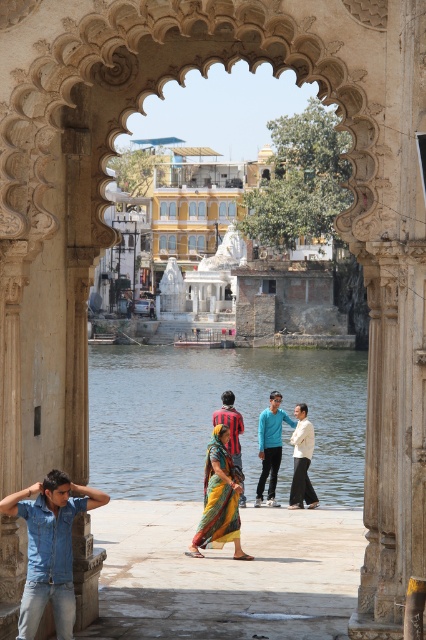
Question: Is denim shirt at lower left thinner than yellow silk saree at center?

Choices:
 (A) no
 (B) yes

Answer: (B)

Question: Which object is farther from the camera taking this photo?

Choices:
 (A) white cotton dress at center
 (B) vivid yellow sari at center
 (C) clear water at center

Answer: (A)

Question: Which point appears farthest from the camera in this image?

Choices:
 (A) (34, 518)
 (B) (293, 438)

Answer: (B)

Question: Which is farther from the white cotton dress at center?

Choices:
 (A) white marble palace at center
 (B) clear water at center
 (C) yellow silk saree at center
 (D) blue cotton shirt at center

Answer: (A)

Question: Can you confirm if white marble palace at center is positioned to the right of denim shirt at lower left?

Choices:
 (A) yes
 (B) no

Answer: (B)

Question: Does yellow silk saree at center have a smaller size compared to vivid yellow sari at center?

Choices:
 (A) no
 (B) yes

Answer: (B)